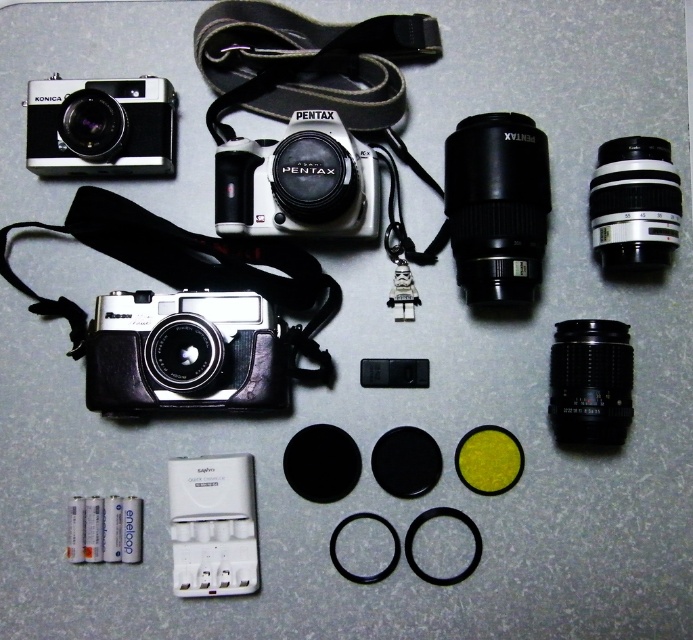
Based on the photo, you are a photographer who wants to place a ruler between the two black plastic lenses to measure the distance between them. Which lens should you place the ruler next to first, the black plastic lens at upper center or the black plastic lens at upper right?

Both lenses are 5.32 inches apart. You can start measuring from either the black plastic lens at upper center or the black plastic lens at upper right since the distance between them is the same.

You are setting up a photography studio and need to place a matte black camera at center and a black plastic lens at upper right on a table. The table has a maximum allowable distance of 20 inches between any two items for safety. Will the current placement violate the safety rule?

The distance between the matte black camera at center and the black plastic lens at upper right is 22.53 inches, which exceeds the 20 inches safety limit. Therefore, the current placement violates the safety rule.